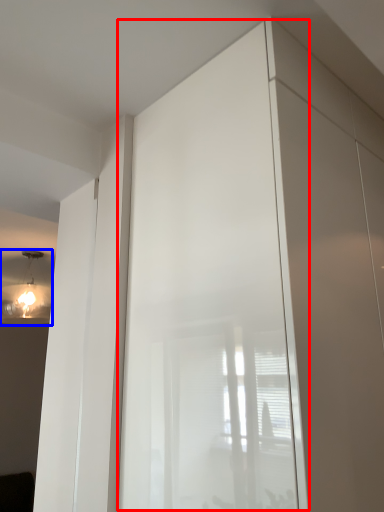
Question: Which object appears closest to the camera in this image, screen door (highlighted by a red box) or light fixture (highlighted by a blue box)?

Choices:
 (A) screen door
 (B) light fixture

Answer: (A)